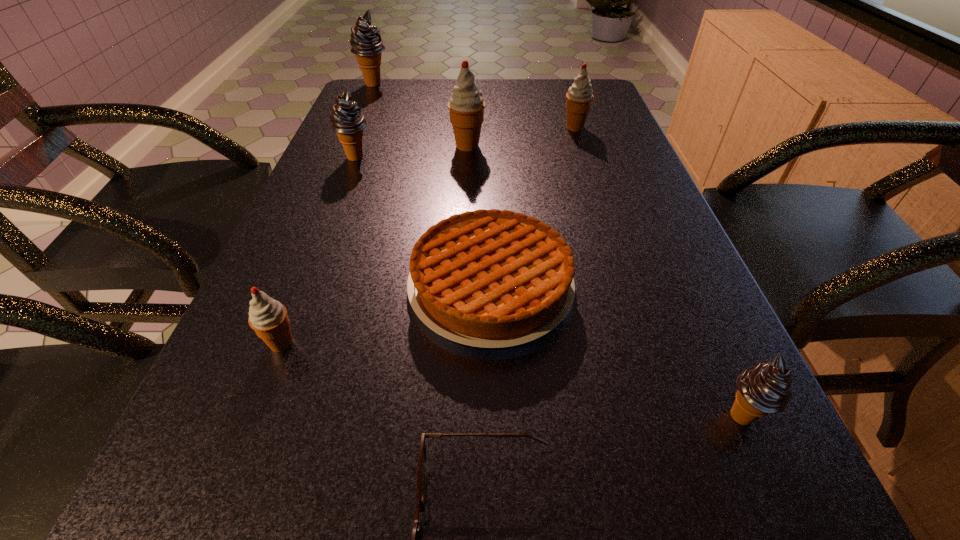
Where is `vacant space that satisfies the following two spatial constraints: 1. on the front side of the leftmost red icecream; 2. on the left side of the farthest icecream`? The image size is (960, 540). vacant space that satisfies the following two spatial constraints: 1. on the front side of the leftmost red icecream; 2. on the left side of the farthest icecream is located at coordinates (263, 343).